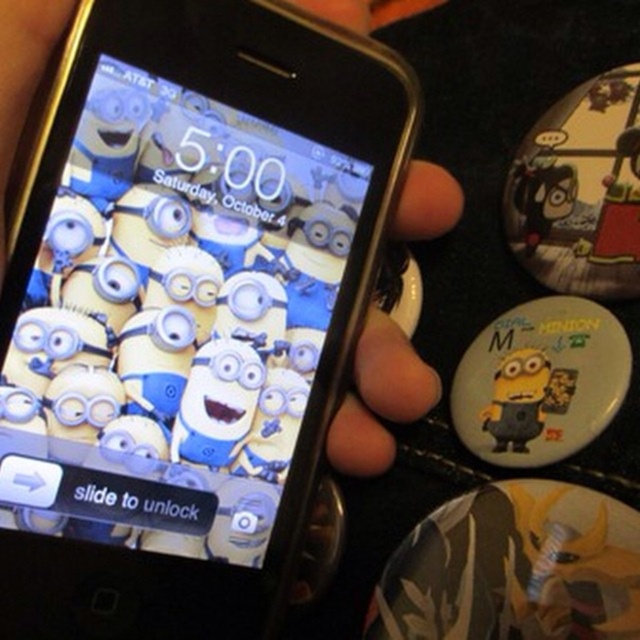
Question: Is the position of black plastic smartphone at center less distant than that of white matte badge at lower right?

Choices:
 (A) no
 (B) yes

Answer: (B)

Question: Is black plastic smartphone at center to the left of white matte badge at lower right from the viewer's perspective?

Choices:
 (A) yes
 (B) no

Answer: (A)

Question: Can you confirm if black plastic smartphone at center is positioned below white matte badge at lower right?

Choices:
 (A) yes
 (B) no

Answer: (B)

Question: Which point is farther to the camera?

Choices:
 (A) white matte badge at lower right
 (B) black plastic smartphone at center

Answer: (A)

Question: Which object is closer to the camera taking this photo?

Choices:
 (A) white matte badge at lower right
 (B) black plastic smartphone at center

Answer: (B)